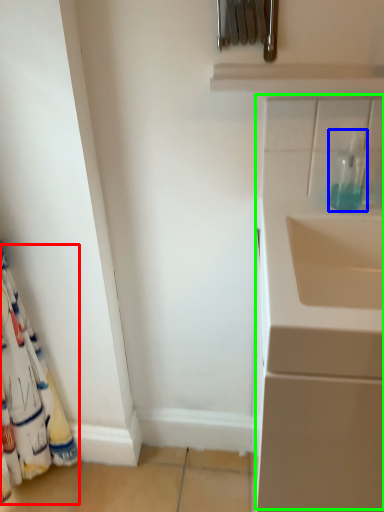
Question: Which is nearer to the curtain (highlighted by a red box)? bottle (highlighted by a blue box) or wide (highlighted by a green box).

Choices:
 (A) bottle
 (B) wide

Answer: (B)